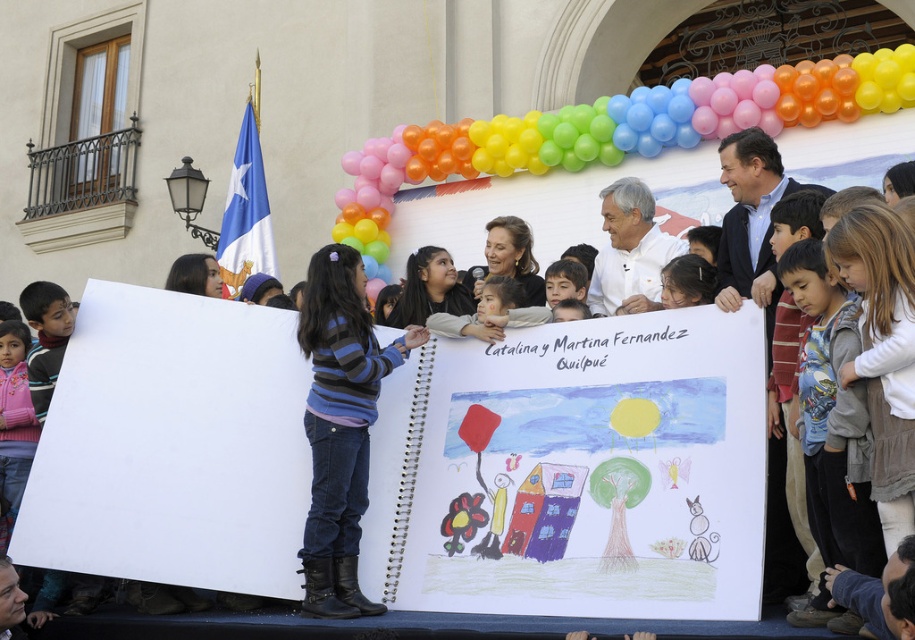
Who is more forward, (822,518) or (16,330)?

Point (822,518)

I want to click on gray sweater at lower right, so click(x=827, y=417).

Between point (364, 456) and point (817, 352), which one is positioned behind?

Point (364, 456)

How far apart are striped sweater at center and gray sweater at lower right?

The distance of striped sweater at center from gray sweater at lower right is 43.58 feet.

Between point (332, 516) and point (849, 413), which one is positioned behind?

Point (332, 516)

At what (x,y) coordinates should I click in order to perform the action: click on striped sweater at center. Please return your answer as a coordinate pair (x, y). Looking at the image, I should click on (340, 426).

Can you confirm if white paper at center is positioned to the left of multicolored balloons at upper center?

Correct, you'll find white paper at center to the left of multicolored balloons at upper center.

Can you confirm if white paper at center is thinner than multicolored balloons at upper center?

Yes, white paper at center is thinner than multicolored balloons at upper center.

Where is `white paper at center`? white paper at center is located at coordinates (580, 470).

The image size is (915, 640). I want to click on white paper at center, so [x=580, y=470].